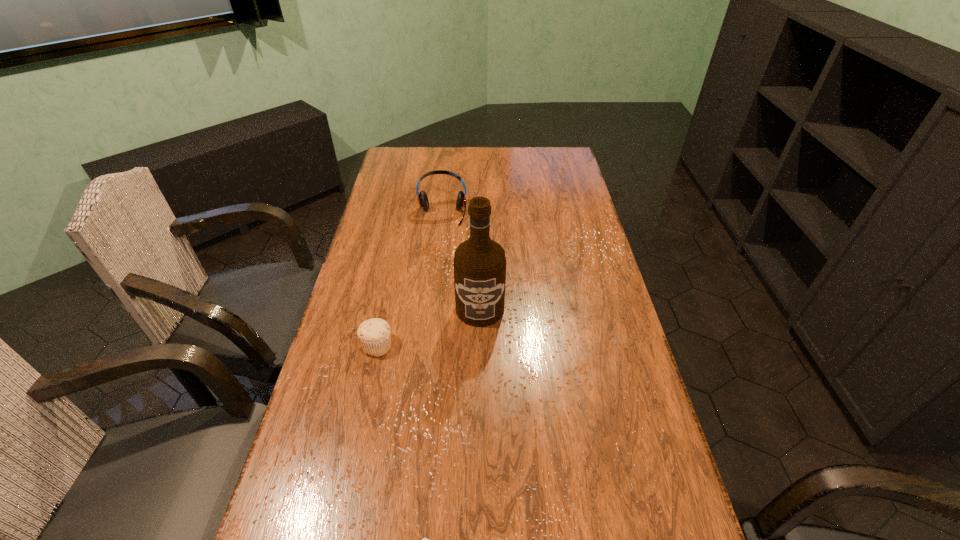
Image resolution: width=960 pixels, height=540 pixels. I want to click on the tallest object, so click(x=479, y=264).

I want to click on alcohol, so click(479, 264).

Image resolution: width=960 pixels, height=540 pixels. In order to click on the third shortest object in this screenshot , I will do [423, 201].

Identify the location of the farthest object. This screenshot has width=960, height=540. (423, 201).

What are the coordinates of `the second shortest object` in the screenshot? It's located at (374, 334).

This screenshot has height=540, width=960. In order to click on the second nearest object in this screenshot , I will do `click(374, 334)`.

Image resolution: width=960 pixels, height=540 pixels. I want to click on vacant space situated on the label of the third nearest object, so [x=480, y=455].

You are a GUI agent. You are given a task and a screenshot of the screen. Output one action in this format:
    pyautogui.click(x=<x>, y=<y>)
    Task: Click on the vacant space located 0.050m with the microphone attached to the side of the third shortest object
    The height and width of the screenshot is (540, 960).
    Given the screenshot: What is the action you would take?
    pyautogui.click(x=440, y=234)

The height and width of the screenshot is (540, 960). In order to click on vacant space located 0.250m on the right of the leftmost object in this screenshot , I will do `click(486, 346)`.

What are the coordinates of `object present at the left edge` in the screenshot? It's located at (374, 334).